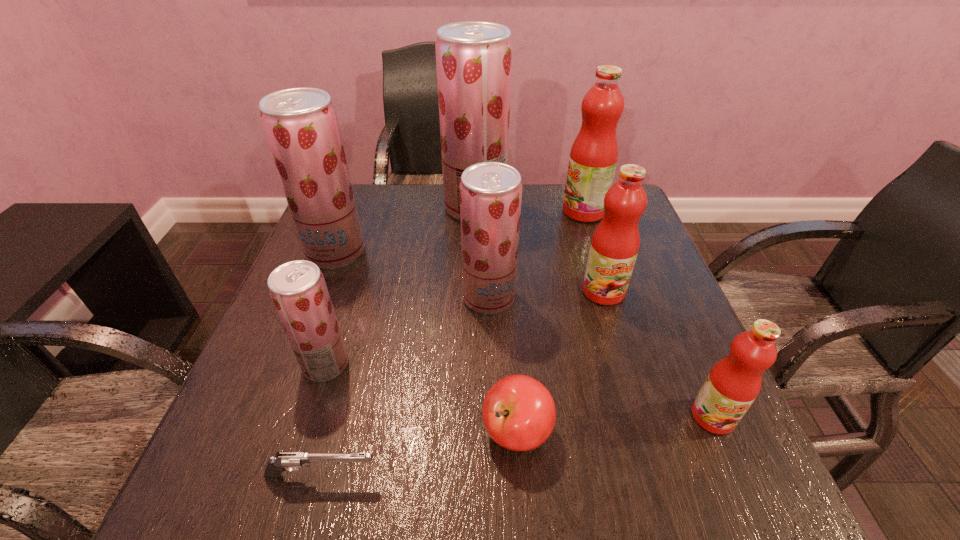
Identify the location of object present at the far right corner. (593, 158).

At what (x,y) coordinates should I click in order to perform the action: click on vacant space at the far edge of the desktop. Please return your answer as a coordinate pair (x, y). This screenshot has width=960, height=540. Looking at the image, I should click on (430, 209).

Image resolution: width=960 pixels, height=540 pixels. I want to click on vacant space at the left edge, so click(308, 446).

Where is `free space at the right edge of the desktop`? free space at the right edge of the desktop is located at coordinates (670, 302).

Where is `vacant region at the far left corner of the desktop`? This screenshot has width=960, height=540. vacant region at the far left corner of the desktop is located at coordinates (369, 217).

This screenshot has width=960, height=540. Find the location of `free region at the near left corner of the desktop`. free region at the near left corner of the desktop is located at coordinates (278, 500).

Image resolution: width=960 pixels, height=540 pixels. In order to click on free spot between the tallest fruit juice and the seventh nearest object in this screenshot , I will do `click(405, 230)`.

At what (x,y) coordinates should I click in order to perform the action: click on free space between the farthest strawberry fruit juice and the second nearest pink fruit juice. Please return your answer as a coordinate pair (x, y). The height and width of the screenshot is (540, 960). Looking at the image, I should click on (540, 249).

Identify the location of vacant region between the pistol and the farthest pink fruit juice. This screenshot has width=960, height=540. (453, 343).

In order to click on vacant space in between the red apple and the fifth nearest fruit juice in this screenshot , I will do `click(426, 342)`.